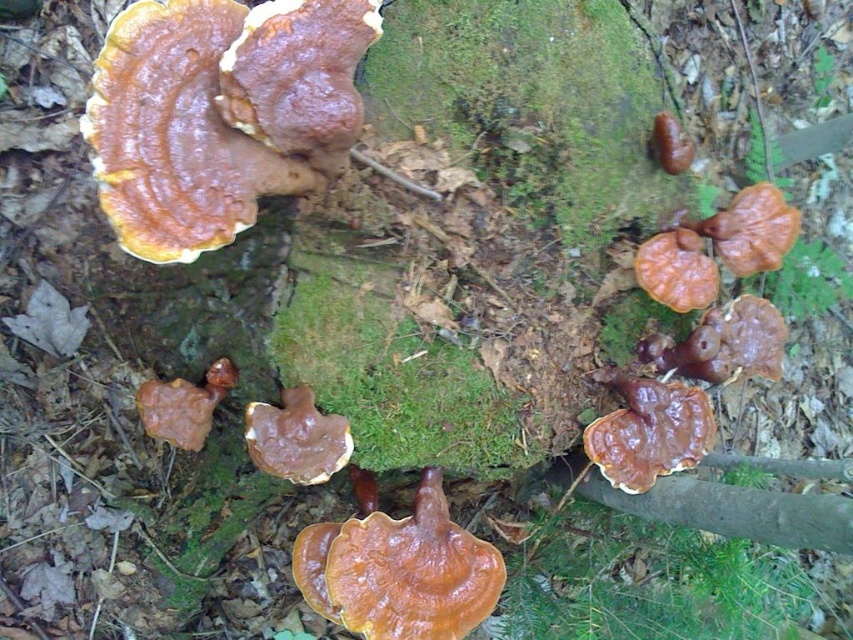
Question: Which point appears closest to the camera in this image?

Choices:
 (A) (171, 387)
 (B) (682, 308)
 (C) (318, 419)

Answer: (C)

Question: Among these points, which one is farthest from the camera?

Choices:
 (A) (657, 150)
 (B) (305, 440)
 (C) (193, 422)

Answer: (A)

Question: Is brown matte mushroom at upper left to the left of brown matte mushroom at center from the viewer's perspective?

Choices:
 (A) no
 (B) yes

Answer: (B)

Question: Estimate the real-world distances between objects in this image. Which object is closer to the glossy orange fungus at lower right?

Choices:
 (A) brown matte fungus at center
 (B) brown leathery mushroom at lower right
 (C) brown matte mushroom at center
 (D) brown matte mushroom at upper left

Answer: (A)

Question: Can you confirm if brown matte fungus at center is positioned above shiny orange bracket fungus at right?

Choices:
 (A) no
 (B) yes

Answer: (A)

Question: Can you confirm if glossy orange fungus at lower right is wider than brown leathery fungus at center?

Choices:
 (A) yes
 (B) no

Answer: (A)